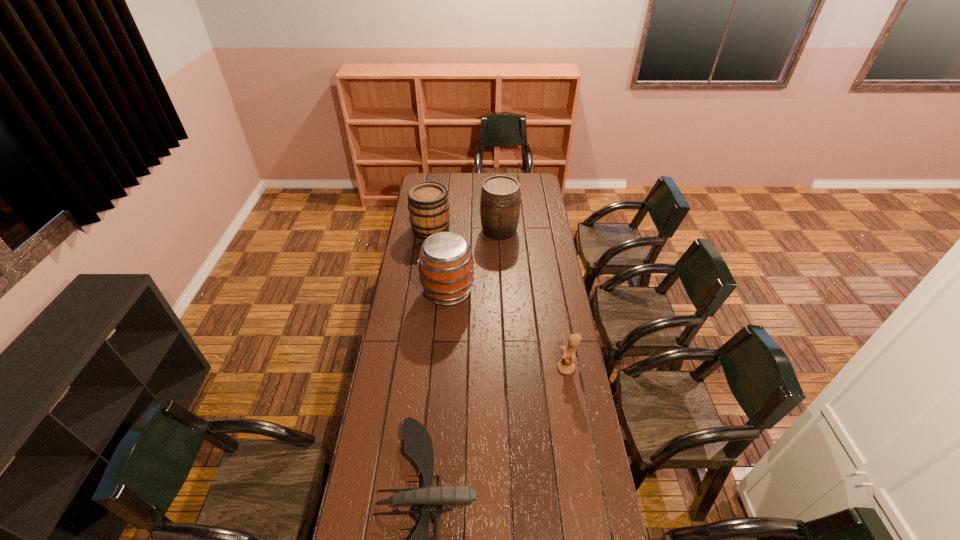
In order to click on the second object from right to left in this screenshot , I will do `click(500, 196)`.

Locate an element on the screen. The width and height of the screenshot is (960, 540). the nearest cider is located at coordinates (446, 266).

You are a GUI agent. You are given a task and a screenshot of the screen. Output one action in this format:
    pyautogui.click(x=<x>, y=<y>)
    Task: Click on the shortest cider
    This screenshot has width=960, height=540.
    Given the screenshot: What is the action you would take?
    pyautogui.click(x=428, y=204)

Identify the location of the rightmost object. (566, 365).

The image size is (960, 540). In order to click on the fourth farthest object in this screenshot , I will do `click(566, 365)`.

Find the location of a particular element. vacant space located on the side of the fourth object from left to right near the bung hole is located at coordinates pos(502,290).

Find the location of a particular element. Image resolution: width=960 pixels, height=540 pixels. free space located 0.360m on the back of the third farthest object is located at coordinates (453, 231).

Identify the location of free space located 0.350m on the right of the shortest cider. (513, 229).

Find the location of a particular element. Image resolution: width=960 pixels, height=540 pixels. vacant space situated on the front-facing side of the rightmost object is located at coordinates pos(469,368).

I want to click on vacant space located on the front-facing side of the rightmost object, so click(x=467, y=368).